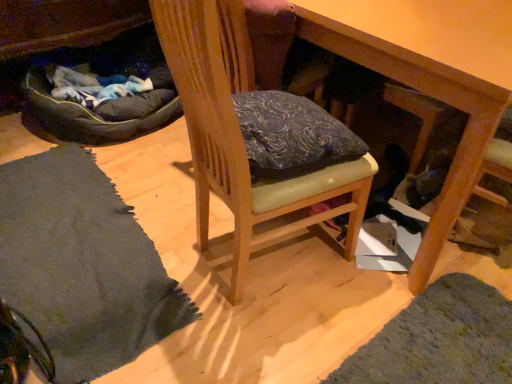
At what (x,y) coordinates should I click in order to perform the action: click on vacant space behind soft gray rug at lower left. Please return your answer as a coordinate pair (x, y). Image resolution: width=512 pixels, height=384 pixels. Looking at the image, I should click on (132, 352).